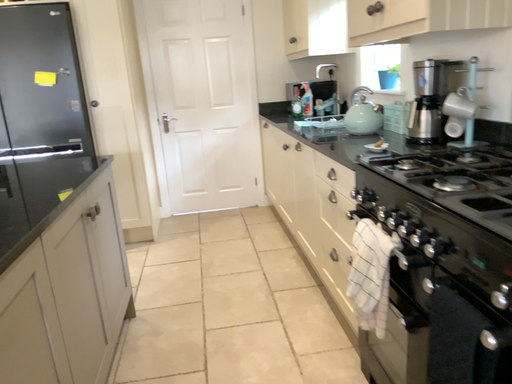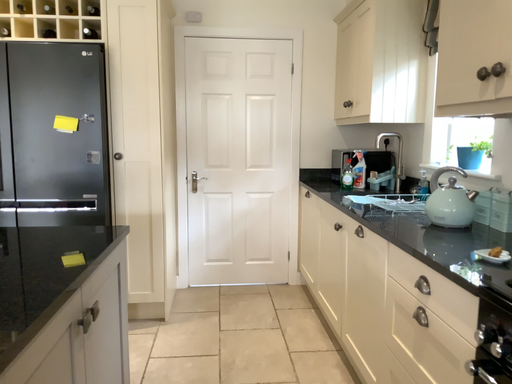
Question: How did the camera likely rotate when shooting the video?

Choices:
 (A) rotated downward
 (B) rotated upward

Answer: (B)